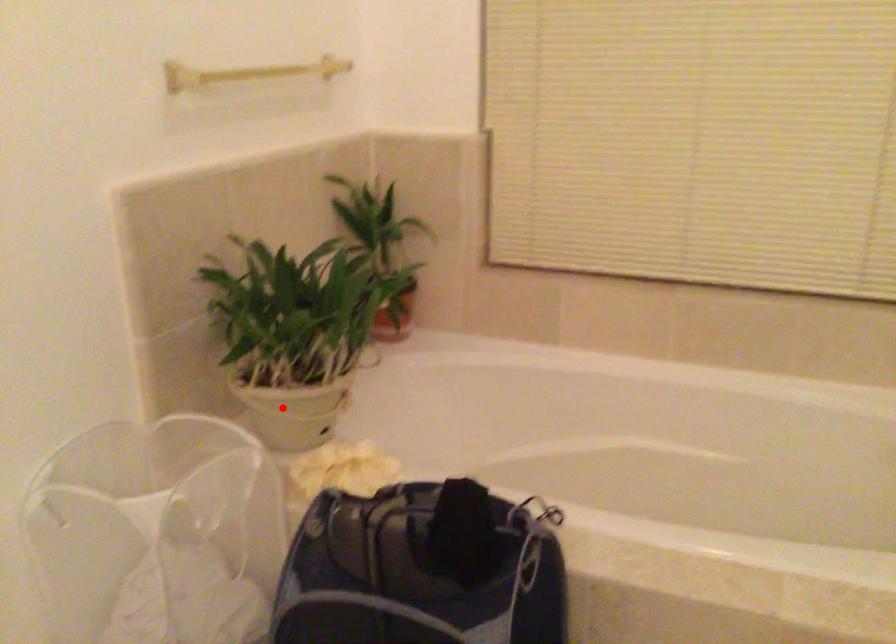
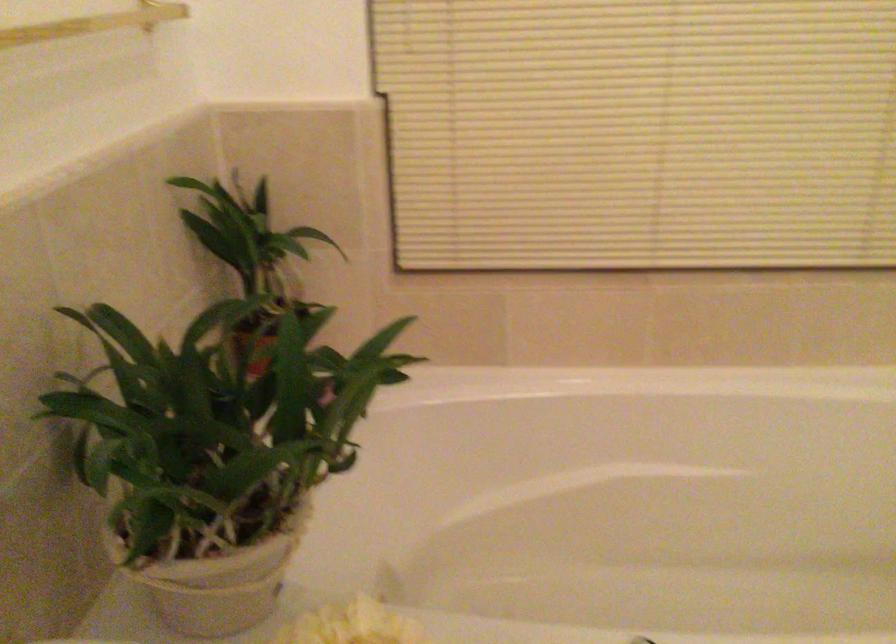
Question: I am providing you with two images of the same scene from different viewpoints. Given a red point in image1, look at the same physical point in image2. Is it:

Choices:
 (A) Closer to the viewpoint
 (B) Farther from the viewpoint

Answer: (A)